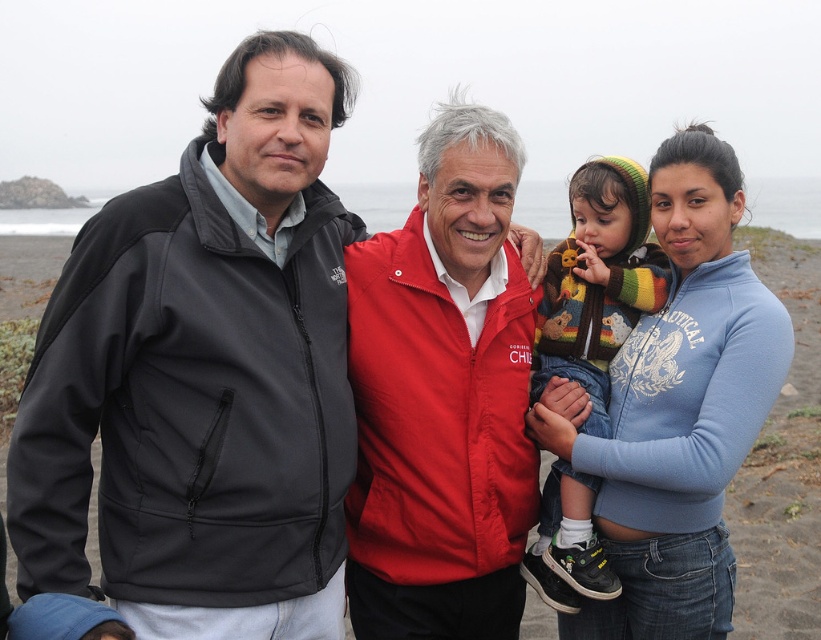
Between red matte jacket at center and blue fleece jacket at center, which one appears on the right side from the viewer's perspective?

From the viewer's perspective, blue fleece jacket at center appears more on the right side.

Measure the distance between point (381, 458) and camera.

Point (381, 458) is 4.97 meters away from camera.

Is point (398, 627) positioned before point (650, 448)?

No, (398, 627) is further to viewer.

Where is `red matte jacket at center`? red matte jacket at center is located at coordinates (443, 397).

Is point (195, 417) positioned after point (658, 600)?

No.

Image resolution: width=821 pixels, height=640 pixels. What do you see at coordinates (204, 376) in the screenshot?
I see `matte black jacket at left` at bounding box center [204, 376].

This screenshot has width=821, height=640. What do you see at coordinates (204, 376) in the screenshot?
I see `matte black jacket at left` at bounding box center [204, 376].

Where is `matte black jacket at left`? This screenshot has width=821, height=640. matte black jacket at left is located at coordinates (204, 376).

What do you see at coordinates (443, 397) in the screenshot? I see `red matte jacket at center` at bounding box center [443, 397].

Which is more to the left, red matte jacket at center or knitted wool sweater at center?

red matte jacket at center

Which is in front, point (457, 609) or point (597, 188)?

Point (457, 609) is in front.

This screenshot has height=640, width=821. Identify the location of red matte jacket at center. (443, 397).